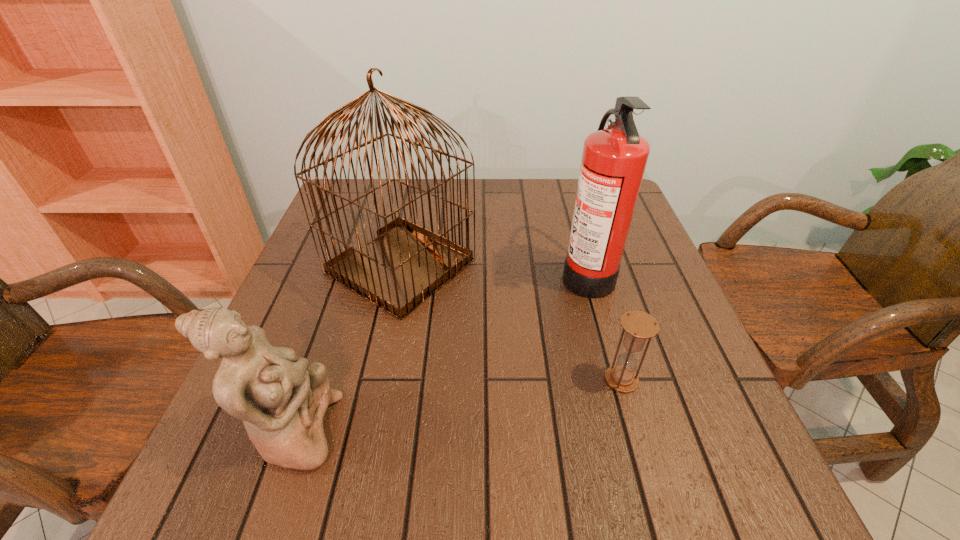
Where is `object that is at the near edge`? Image resolution: width=960 pixels, height=540 pixels. object that is at the near edge is located at coordinates (282, 400).

At what (x,y) coordinates should I click in order to perform the action: click on birdcage at the left edge. Please return your answer as a coordinate pair (x, y). Looking at the image, I should click on (407, 263).

Find the location of a particular element. figurine present at the left edge is located at coordinates (282, 400).

The image size is (960, 540). In order to click on fire extinguisher located at the right edge in this screenshot , I will do coord(614,159).

Find the location of `hourglass located at the right edge`. hourglass located at the right edge is located at coordinates [x=638, y=325].

You are a GUI agent. You are given a task and a screenshot of the screen. Output one action in this format:
    pyautogui.click(x=<x>, y=<y>)
    Task: Click on the object at the near left corner
    
    Given the screenshot: What is the action you would take?
    pyautogui.click(x=282, y=400)

This screenshot has width=960, height=540. In the image, there is a desktop. Identify the location of vacant space at the far edge. (554, 195).

Locate an element on the screen. free space at the near edge is located at coordinates (621, 476).

At what (x,y) coordinates should I click in order to perform the action: click on vacant region at the left edge of the desktop. Please return your answer as a coordinate pair (x, y). The width and height of the screenshot is (960, 540). Looking at the image, I should click on (354, 246).

Image resolution: width=960 pixels, height=540 pixels. I want to click on vacant space at the right edge of the desktop, so click(x=645, y=366).